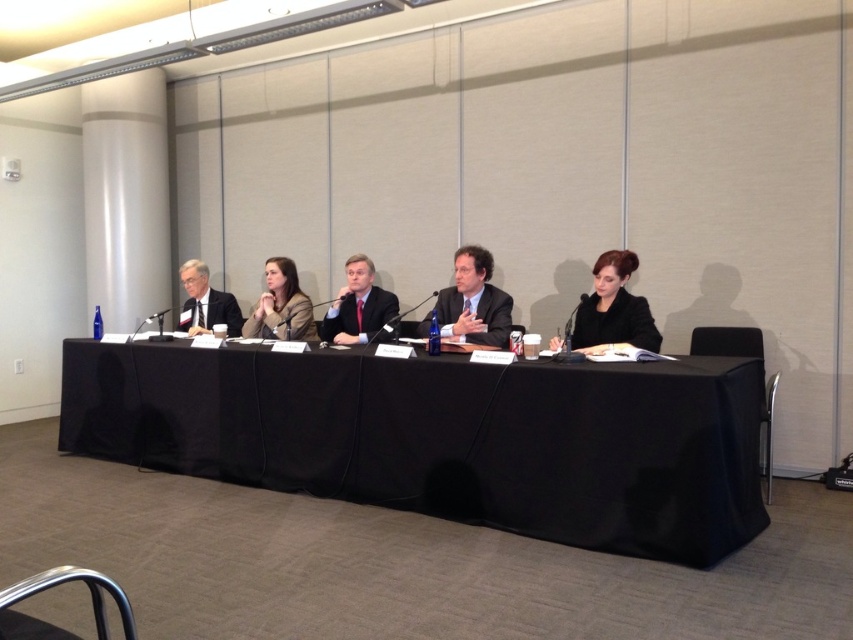
Question: Based on their relative distances, which object is farther from the matte brown blazer at center?

Choices:
 (A) matte black suit at center
 (B) black fabric table at center
 (C) matte black suit at left
 (D) dark gray suit at center

Answer: (D)

Question: Which of these objects is positioned farthest from the dark gray suit at center?

Choices:
 (A) matte black suit at center
 (B) black fabric table at center
 (C) matte black suit at left
 (D) matte brown blazer at center

Answer: (C)

Question: Is dark gray suit at center positioned at the back of matte brown blazer at center?

Choices:
 (A) no
 (B) yes

Answer: (A)

Question: Which of the following is the farthest from the observer?

Choices:
 (A) matte black suit at left
 (B) matte black suit at right
 (C) matte brown blazer at center

Answer: (A)

Question: In this image, where is dark gray suit at center located relative to matte brown blazer at center?

Choices:
 (A) left
 (B) right

Answer: (B)

Question: Considering the relative positions of matte black suit at right and matte brown blazer at center in the image provided, where is matte black suit at right located with respect to matte brown blazer at center?

Choices:
 (A) below
 (B) above

Answer: (A)